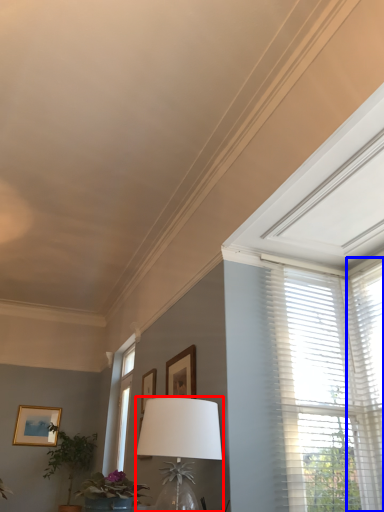
Question: Which of the following is the farthest to the observer, table lamp (highlighted by a red box) or window blind (highlighted by a blue box)?

Choices:
 (A) table lamp
 (B) window blind

Answer: (B)